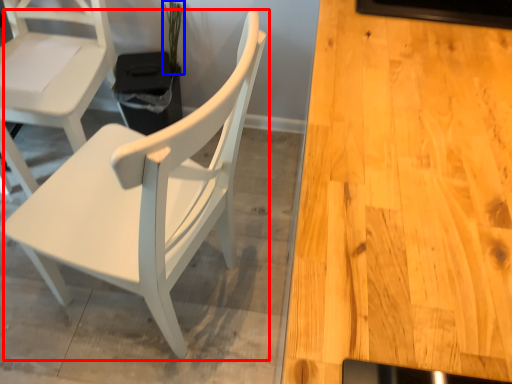
Question: Which point is further to the camera, chair (highlighted by a red box) or plant (highlighted by a blue box)?

Choices:
 (A) chair
 (B) plant

Answer: (B)